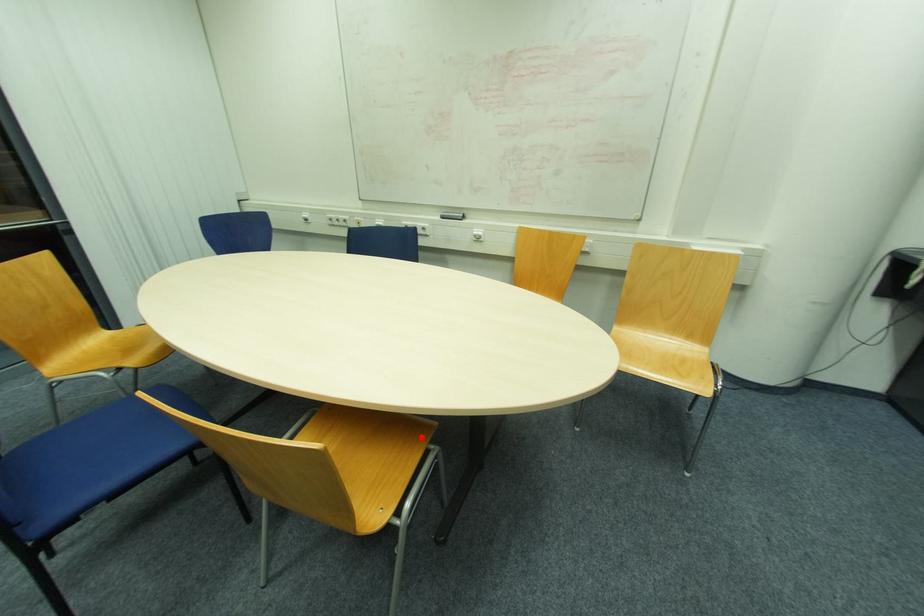
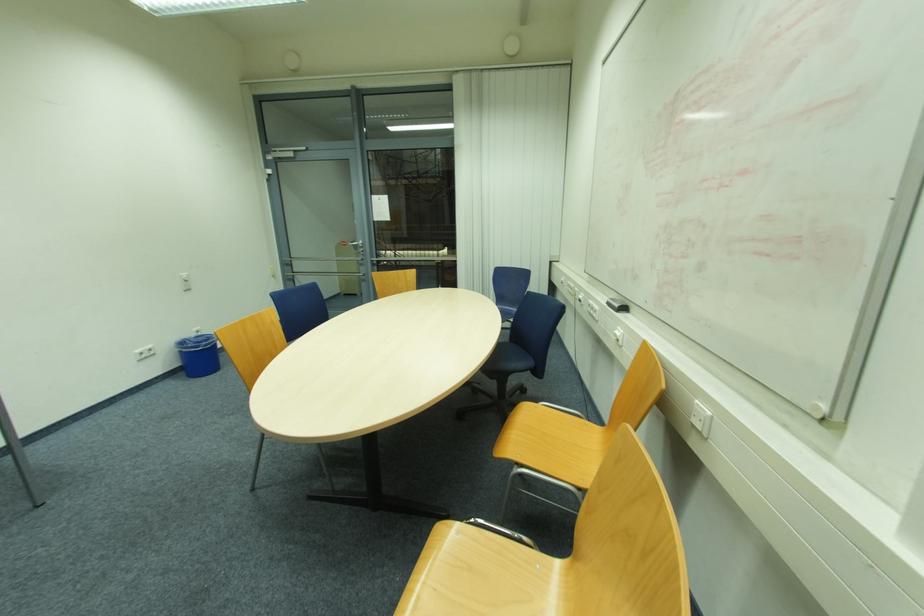
Question: I am providing you with two images of the same scene from different viewpoints. A red point is marked on the first image. Is the red point's position out of view in image 2?

Choices:
 (A) Yes
 (B) No

Answer: (A)